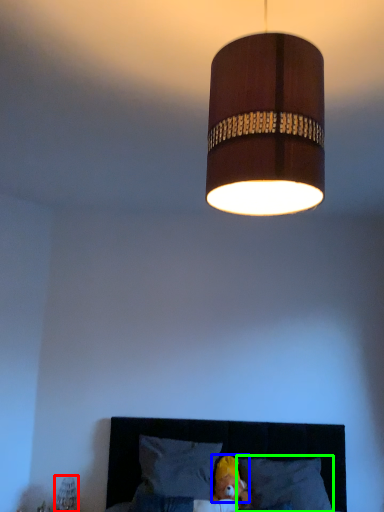
Question: Which object is the farthest from bedside lamp (highlighted by a red box)? Choose among these: head (highlighted by a blue box) or pillow (highlighted by a green box).

Choices:
 (A) head
 (B) pillow

Answer: (B)